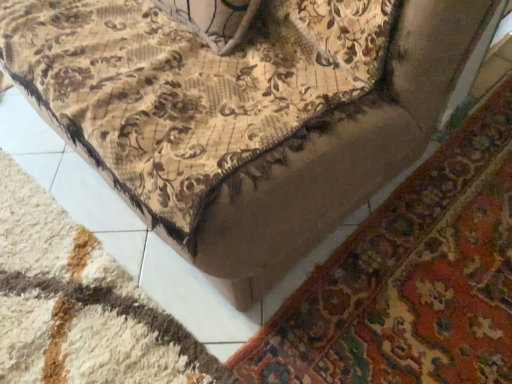
What do you see at coordinates (80, 304) in the screenshot? I see `beige textured mat at lower center, positioned as the 1th mat in left-to-right order` at bounding box center [80, 304].

What is the approximate height of beige textured mat at lower center, positioned as the 2th mat in right-to-left order?

beige textured mat at lower center, positioned as the 2th mat in right-to-left order, is 2.84 inches tall.

Locate an element on the screen. The image size is (512, 384). beige textured mat at lower center, positioned as the 2th mat in right-to-left order is located at coordinates (80, 304).

Find the location of a particular element. floral fabric mat at lower right, which is the 2th mat from left to right is located at coordinates (411, 279).

What do you see at coordinates (411, 279) in the screenshot?
I see `floral fabric mat at lower right, which ranks as the first mat in right-to-left order` at bounding box center [411, 279].

The width and height of the screenshot is (512, 384). I want to click on beige textured mat at lower center, positioned as the 2th mat in right-to-left order, so click(80, 304).

Does floral fabric mat at lower right, which ranks as the first mat in right-to-left order, appear on the right side of beige textured mat at lower center, positioned as the 2th mat in right-to-left order?

Yes, floral fabric mat at lower right, which ranks as the first mat in right-to-left order, is to the right of beige textured mat at lower center, positioned as the 2th mat in right-to-left order.

Does floral fabric mat at lower right, which ranks as the first mat in right-to-left order, lie behind beige textured mat at lower center, positioned as the 2th mat in right-to-left order?

Yes, floral fabric mat at lower right, which ranks as the first mat in right-to-left order, is further from the viewer.

Considering the positions of points (498, 333) and (111, 276), is point (498, 333) farther from camera compared to point (111, 276)?

That is False.

From the image's perspective, is floral fabric mat at lower right, which is the 2th mat from left to right, positioned above or below beige textured mat at lower center, positioned as the 1th mat in left-to-right order?

Based on their image positions, floral fabric mat at lower right, which is the 2th mat from left to right, is located above beige textured mat at lower center, positioned as the 1th mat in left-to-right order.

From a real-world perspective, is floral fabric mat at lower right, which is the 2th mat from left to right, located higher than beige textured mat at lower center, positioned as the 2th mat in right-to-left order?

Actually, floral fabric mat at lower right, which is the 2th mat from left to right, is physically below beige textured mat at lower center, positioned as the 2th mat in right-to-left order, in the real world.

Does floral fabric mat at lower right, which ranks as the first mat in right-to-left order, have a greater width compared to beige textured mat at lower center, positioned as the 2th mat in right-to-left order?

Yes, floral fabric mat at lower right, which ranks as the first mat in right-to-left order, is wider than beige textured mat at lower center, positioned as the 2th mat in right-to-left order.

Can you confirm if floral fabric mat at lower right, which is the 2th mat from left to right, is shorter than beige textured mat at lower center, positioned as the 2th mat in right-to-left order?

Yes.

Between floral fabric mat at lower right, which ranks as the first mat in right-to-left order, and beige textured mat at lower center, positioned as the 1th mat in left-to-right order, which one has larger size?

beige textured mat at lower center, positioned as the 1th mat in left-to-right order, is bigger.

Choose the correct answer: Is floral fabric mat at lower right, which is the 2th mat from left to right, inside beige textured mat at lower center, positioned as the 1th mat in left-to-right order, or outside it?

floral fabric mat at lower right, which is the 2th mat from left to right, is not enclosed by beige textured mat at lower center, positioned as the 1th mat in left-to-right order.

Is floral fabric mat at lower right, which is the 2th mat from left to right, placed right next to beige textured mat at lower center, positioned as the 2th mat in right-to-left order?

No, floral fabric mat at lower right, which is the 2th mat from left to right, is not next to beige textured mat at lower center, positioned as the 2th mat in right-to-left order.

Is floral fabric mat at lower right, which ranks as the first mat in right-to-left order, looking in the opposite direction of beige textured mat at lower center, positioned as the 2th mat in right-to-left order?

No, floral fabric mat at lower right, which ranks as the first mat in right-to-left order, is not facing the opposite direction of beige textured mat at lower center, positioned as the 2th mat in right-to-left order.

In the image, there is a beige textured mat at lower center, positioned as the 1th mat in left-to-right order. Identify the location of mat below it (from a real-world perspective). (411, 279).

Considering the relative positions of beige textured mat at lower center, positioned as the 2th mat in right-to-left order, and floral fabric mat at lower right, which is the 2th mat from left to right, in the image provided, is beige textured mat at lower center, positioned as the 2th mat in right-to-left order, to the left of floral fabric mat at lower right, which is the 2th mat from left to right, from the viewer's perspective?

Yes.

Is beige textured mat at lower center, positioned as the 1th mat in left-to-right order, closer to the viewer compared to floral fabric mat at lower right, which is the 2th mat from left to right?

Yes.

Does point (42, 353) come farther from viewer compared to point (333, 300)?

That is False.

From the image's perspective, is beige textured mat at lower center, positioned as the 2th mat in right-to-left order, on top of floral fabric mat at lower right, which is the 2th mat from left to right?

No.

From a real-world perspective, relative to floral fabric mat at lower right, which is the 2th mat from left to right, is beige textured mat at lower center, positioned as the 2th mat in right-to-left order, vertically above or below?

In terms of real-world spatial position, beige textured mat at lower center, positioned as the 2th mat in right-to-left order, is above floral fabric mat at lower right, which is the 2th mat from left to right.

Is beige textured mat at lower center, positioned as the 1th mat in left-to-right order, wider than floral fabric mat at lower right, which is the 2th mat from left to right?

Incorrect, the width of beige textured mat at lower center, positioned as the 1th mat in left-to-right order, does not surpass that of floral fabric mat at lower right, which is the 2th mat from left to right.

From their relative heights in the image, would you say beige textured mat at lower center, positioned as the 2th mat in right-to-left order, is taller or shorter than floral fabric mat at lower right, which ranks as the first mat in right-to-left order?

Result: Considering their sizes, beige textured mat at lower center, positioned as the 2th mat in right-to-left order, has more height than floral fabric mat at lower right, which ranks as the first mat in right-to-left order.

Between beige textured mat at lower center, positioned as the 1th mat in left-to-right order, and floral fabric mat at lower right, which ranks as the first mat in right-to-left order, which one has smaller size?

floral fabric mat at lower right, which ranks as the first mat in right-to-left order, is smaller.

Is floral fabric mat at lower right, which ranks as the first mat in right-to-left order, located within beige textured mat at lower center, positioned as the 2th mat in right-to-left order?

No, floral fabric mat at lower right, which ranks as the first mat in right-to-left order, is not inside beige textured mat at lower center, positioned as the 2th mat in right-to-left order.

Is beige textured mat at lower center, positioned as the 1th mat in left-to-right order, not close to floral fabric mat at lower right, which ranks as the first mat in right-to-left order?

No, beige textured mat at lower center, positioned as the 1th mat in left-to-right order, is not far from floral fabric mat at lower right, which ranks as the first mat in right-to-left order.

Could you tell me if beige textured mat at lower center, positioned as the 1th mat in left-to-right order, is turned towards floral fabric mat at lower right, which is the 2th mat from left to right?

Yes, beige textured mat at lower center, positioned as the 1th mat in left-to-right order, is turned towards floral fabric mat at lower right, which is the 2th mat from left to right.

What's the angular difference between beige textured mat at lower center, positioned as the 1th mat in left-to-right order, and floral fabric mat at lower right, which is the 2th mat from left to right,'s facing directions?

179 degrees.

How much distance is there between beige textured mat at lower center, positioned as the 2th mat in right-to-left order, and floral fabric mat at lower right, which is the 2th mat from left to right?

beige textured mat at lower center, positioned as the 2th mat in right-to-left order, and floral fabric mat at lower right, which is the 2th mat from left to right, are 50.87 centimeters apart from each other.

Image resolution: width=512 pixels, height=384 pixels. What are the coordinates of `mat in front of the floral fabric mat at lower right, which is the 2th mat from left to right` in the screenshot? It's located at (80, 304).

At what (x,y) coordinates should I click in order to perform the action: click on mat below the beige textured mat at lower center, positioned as the 1th mat in left-to-right order (from a real-world perspective). Please return your answer as a coordinate pair (x, y). This screenshot has height=384, width=512. Looking at the image, I should click on [411, 279].

The width and height of the screenshot is (512, 384). Find the location of `mat on the right of beige textured mat at lower center, positioned as the 1th mat in left-to-right order`. mat on the right of beige textured mat at lower center, positioned as the 1th mat in left-to-right order is located at coordinates (411, 279).